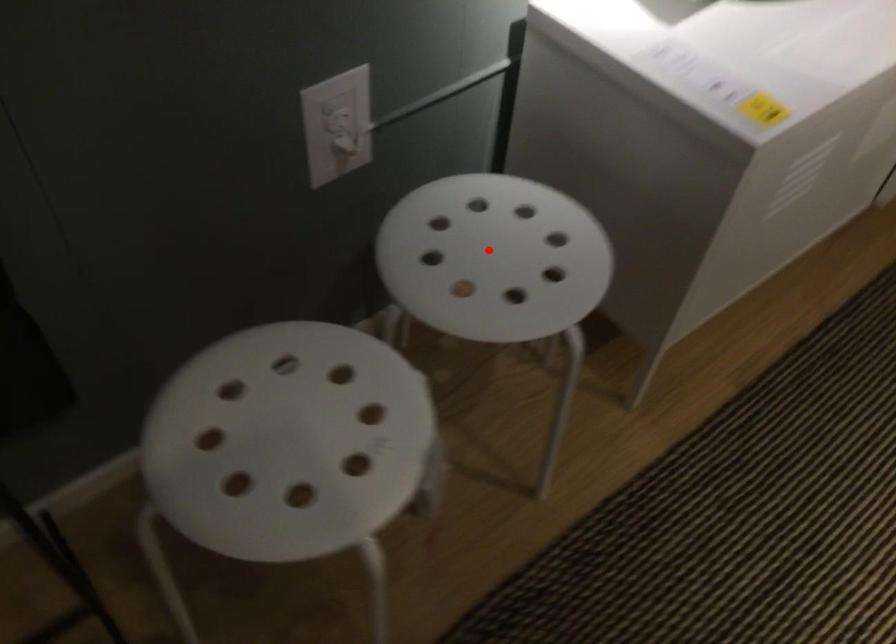
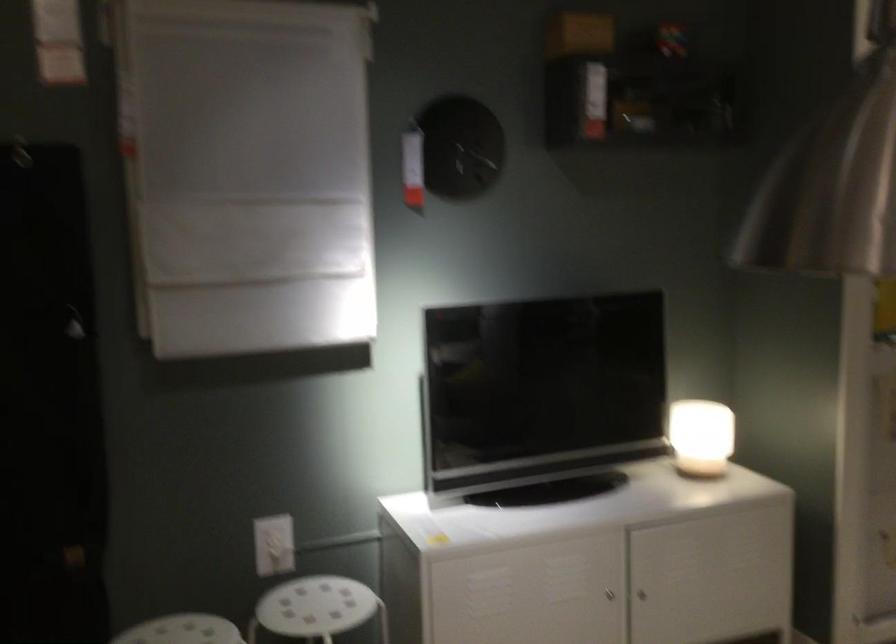
Question: I am providing you with two images of the same scene from different viewpoints. A red point is marked on the first image. Is the red point's position out of view in image 2?

Choices:
 (A) Yes
 (B) No

Answer: (B)